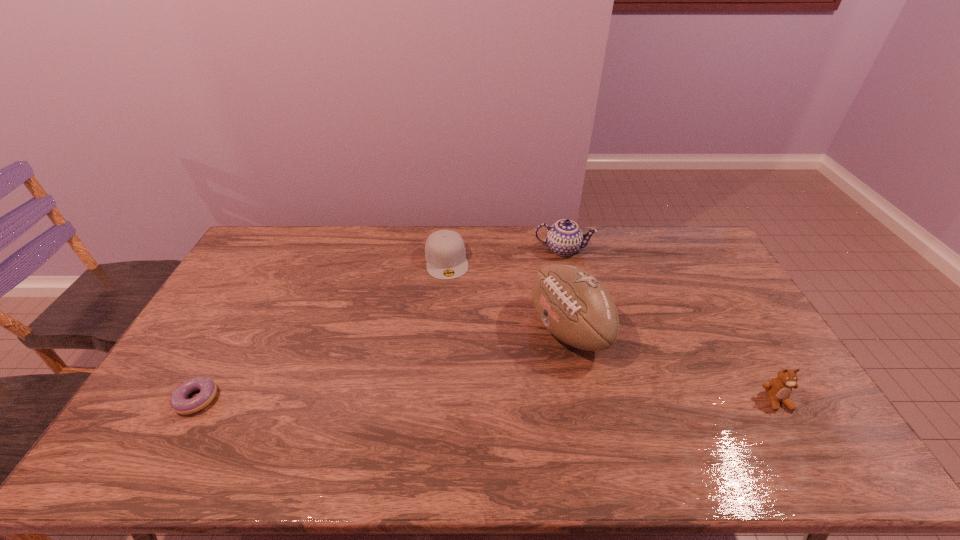
Where is `chinaware present at the far edge`? This screenshot has height=540, width=960. chinaware present at the far edge is located at coordinates (564, 237).

In order to click on doughnut positioned at the near edge in this screenshot , I will do `click(179, 403)`.

Locate an element on the screen. teddy bear at the near edge is located at coordinates (778, 389).

The height and width of the screenshot is (540, 960). I want to click on object that is at the left edge, so click(x=179, y=403).

The width and height of the screenshot is (960, 540). I want to click on object at the right edge, so click(778, 389).

Image resolution: width=960 pixels, height=540 pixels. In order to click on object located in the near left corner section of the desktop in this screenshot , I will do `click(179, 403)`.

The height and width of the screenshot is (540, 960). Find the location of `object that is at the near right corner`. object that is at the near right corner is located at coordinates (778, 389).

The image size is (960, 540). I want to click on vacant point at the far edge, so click(535, 260).

I want to click on vacant space at the near edge of the desktop, so click(x=568, y=420).

In the image, there is a desktop. Where is `vacant region at the left edge`? The width and height of the screenshot is (960, 540). vacant region at the left edge is located at coordinates (159, 390).